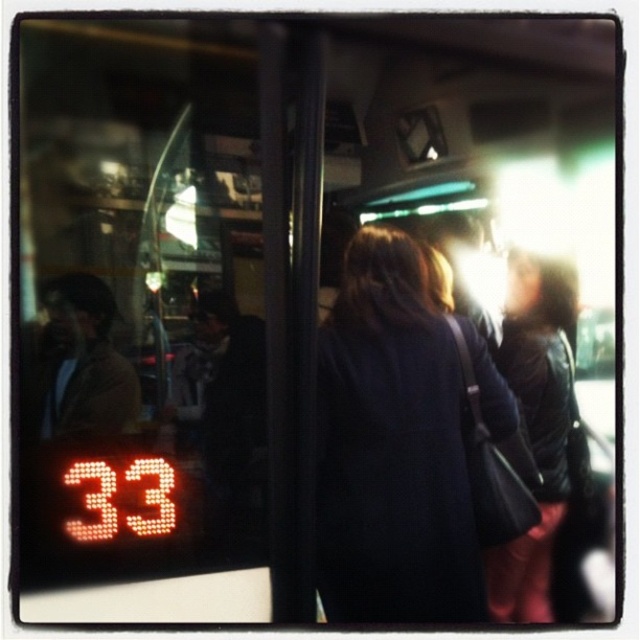
Question: Which of the following is the closest to the observer?

Choices:
 (A) (365, 348)
 (B) (545, 493)

Answer: (A)

Question: Among these objects, which one is farthest from the camera?

Choices:
 (A) dark blue coat at center
 (B) dark brown leather jacket at right

Answer: (B)

Question: Which point appears farthest from the camera in this image?

Choices:
 (A) (432, 488)
 (B) (516, 598)

Answer: (B)

Question: Is dark blue coat at center to the left of dark brown leather jacket at right from the viewer's perspective?

Choices:
 (A) yes
 (B) no

Answer: (A)

Question: In this image, where is dark blue coat at center located relative to dark brown leather jacket at right?

Choices:
 (A) left
 (B) right

Answer: (A)

Question: Is dark blue coat at center to the right of dark brown leather jacket at right from the viewer's perspective?

Choices:
 (A) no
 (B) yes

Answer: (A)